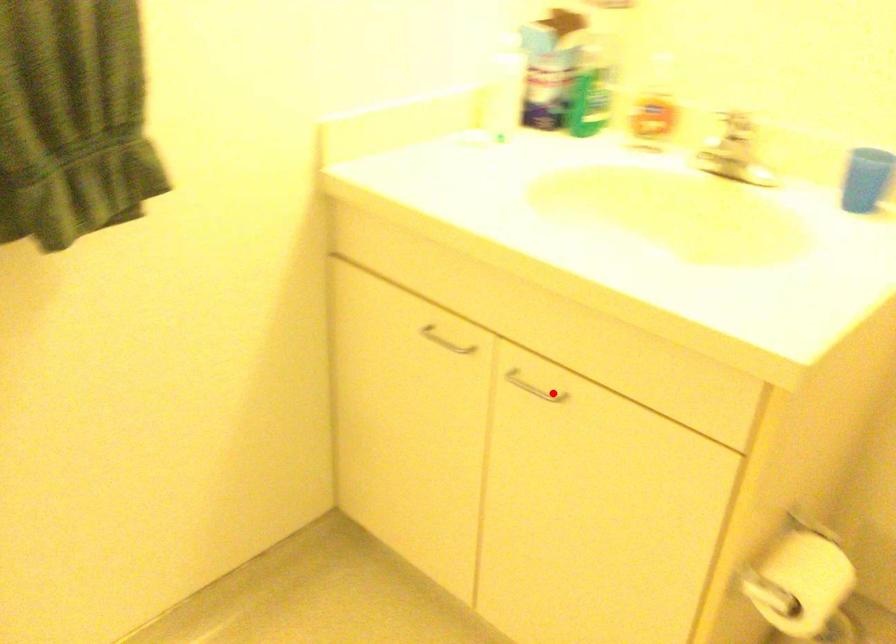
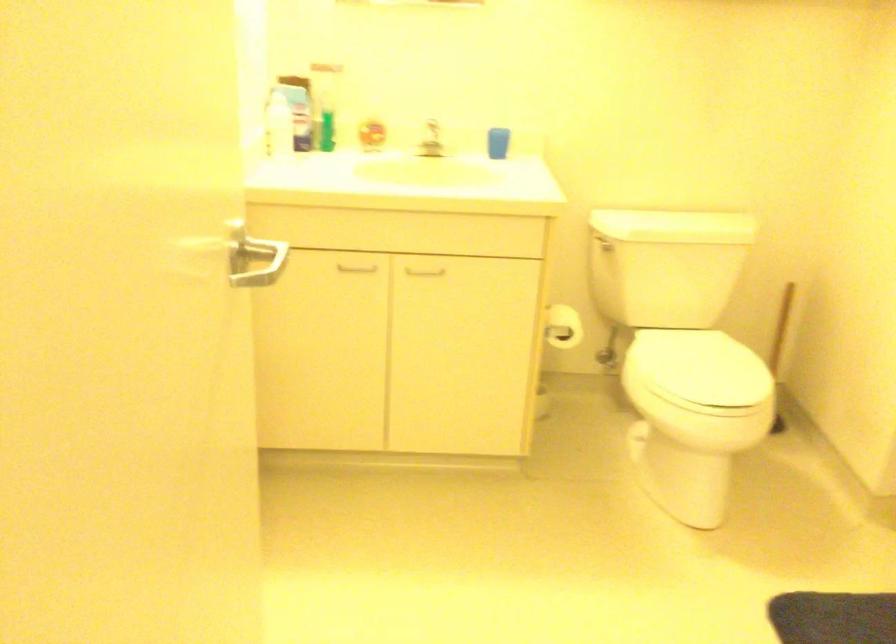
Question: A red point is marked in image1. In image2, is the corresponding 3D point closer to the camera or farther? Reply with the corresponding letter.

Choices:
 (A) The corresponding 3D point is closer.
 (B) The corresponding 3D point is farther.

Answer: (B)